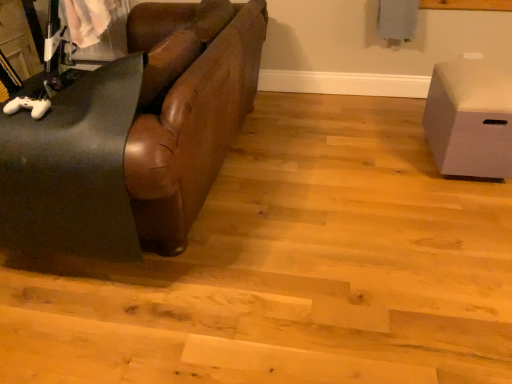
Question: Is the position of white matte storage box at right more distant than that of brown leather couch at left?

Choices:
 (A) no
 (B) yes

Answer: (B)

Question: Is white matte storage box at right positioned with its back to brown leather couch at left?

Choices:
 (A) yes
 (B) no

Answer: (B)

Question: Is white matte storage box at right smaller than brown leather couch at left?

Choices:
 (A) no
 (B) yes

Answer: (B)

Question: From the image's perspective, is white matte storage box at right below brown leather couch at left?

Choices:
 (A) no
 (B) yes

Answer: (B)

Question: Can you confirm if white matte storage box at right is positioned to the left of brown leather couch at left?

Choices:
 (A) yes
 (B) no

Answer: (B)

Question: Is white matte storage box at right at the right side of brown leather couch at left?

Choices:
 (A) yes
 (B) no

Answer: (A)

Question: Considering the relative positions of brown leather couch at left and white matte storage box at right in the image provided, is brown leather couch at left to the right of white matte storage box at right from the viewer's perspective?

Choices:
 (A) no
 (B) yes

Answer: (A)

Question: Can you confirm if brown leather couch at left is taller than white matte storage box at right?

Choices:
 (A) yes
 (B) no

Answer: (A)

Question: Does brown leather couch at left appear on the left side of white matte storage box at right?

Choices:
 (A) no
 (B) yes

Answer: (B)

Question: Is brown leather couch at left wider than white matte storage box at right?

Choices:
 (A) no
 (B) yes

Answer: (B)

Question: Can you confirm if brown leather couch at left is bigger than white matte storage box at right?

Choices:
 (A) yes
 (B) no

Answer: (A)

Question: Does brown leather couch at left have a lesser width compared to white matte storage box at right?

Choices:
 (A) yes
 (B) no

Answer: (B)

Question: Is brown leather couch at left wider or thinner than white matte storage box at right?

Choices:
 (A) wide
 (B) thin

Answer: (A)